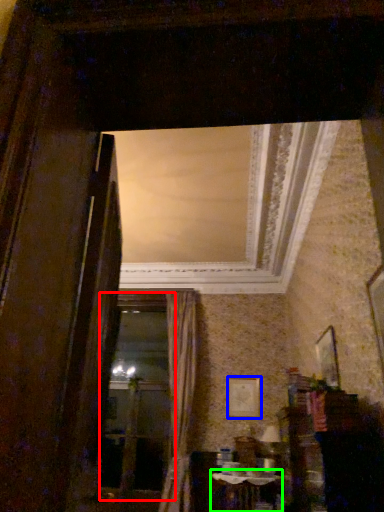
Question: Which is nearer to the window frame (highlighted by a red box)? picture frame (highlighted by a blue box) or table (highlighted by a green box).

Choices:
 (A) picture frame
 (B) table

Answer: (A)